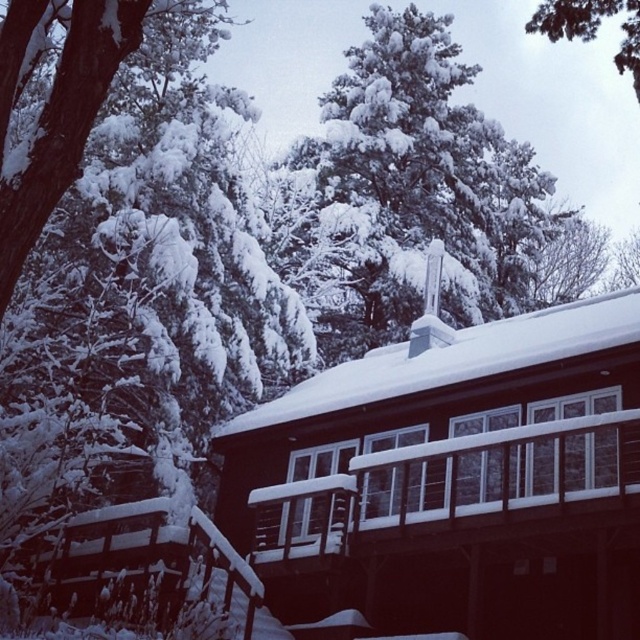
Question: Is snow-covered cabin at center in front of snow-covered pine tree at upper center?

Choices:
 (A) yes
 (B) no

Answer: (A)

Question: Is snow-covered cabin at center closer to the viewer compared to snow-covered pine tree at upper center?

Choices:
 (A) no
 (B) yes

Answer: (B)

Question: Which point is farther to the camera?

Choices:
 (A) (451, 509)
 (B) (349, 125)

Answer: (B)

Question: Is snow-covered cabin at center above snow-covered pine tree at upper center?

Choices:
 (A) yes
 (B) no

Answer: (B)

Question: Which object is closer to the camera taking this photo?

Choices:
 (A) snow-covered pine tree at upper center
 (B) snow-covered cabin at center

Answer: (B)